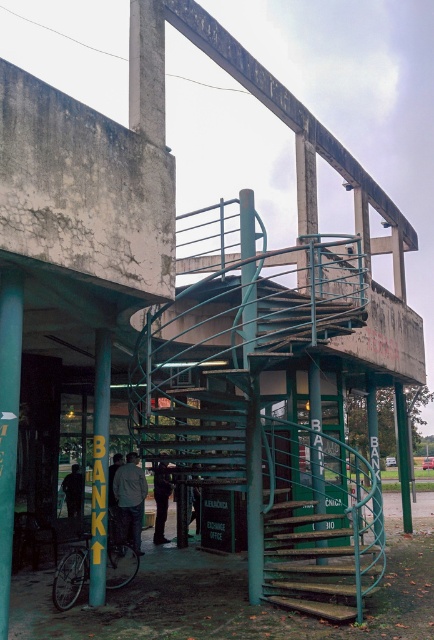
You are a delivery person trying to navigate through the entrance of the bank. You see a dark gray jacket at center and a dark gray pants at center. Which clothing item takes up more horizontal space in the image?

The dark gray jacket at center has a greater width than the dark gray pants at center, so the jacket takes up more horizontal space.